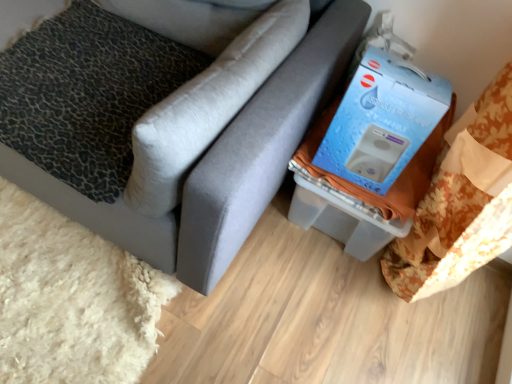
Question: Is matte gray couch at center wider or thinner than blue cardboard box at upper right?

Choices:
 (A) wide
 (B) thin

Answer: (A)

Question: Based on their positions, is matte gray couch at center located to the left or right of blue cardboard box at upper right?

Choices:
 (A) left
 (B) right

Answer: (A)

Question: Considering the real-world distances, which object is farthest from the matte gray couch at center?

Choices:
 (A) leopard print fabric pillow at left, which is counted as the second pillow, starting from the left
 (B) leopard print fabric pillow at left, which is the 2th pillow in right-to-left order
 (C) blue cardboard box at upper right

Answer: (C)

Question: Which is farther from the blue cardboard box at upper right?

Choices:
 (A) leopard print fabric pillow at left, the first pillow from the right
 (B) leopard print fabric pillow at left, the first pillow in the left-to-right sequence
 (C) matte gray couch at center

Answer: (B)